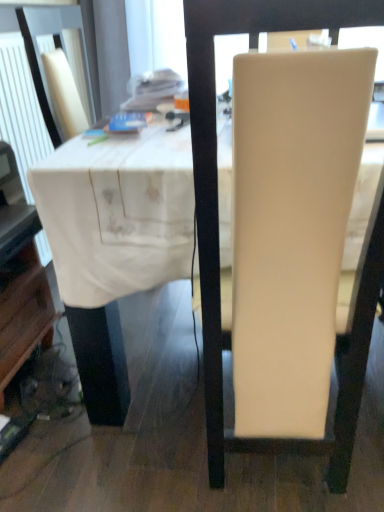
Locate an element on the screen. This screenshot has width=384, height=512. beige leather chair at center is located at coordinates (217, 223).

Image resolution: width=384 pixels, height=512 pixels. What do you see at coordinates (217, 223) in the screenshot?
I see `beige leather chair at center` at bounding box center [217, 223].

You are a GUI agent. You are given a task and a screenshot of the screen. Output one action in this format:
    pyautogui.click(x=<x>, y=<y>)
    Task: Click on the white fabric table at center
    
    Given the screenshot: What is the action you would take?
    pyautogui.click(x=115, y=216)

Describe the element at coordinates (115, 216) in the screenshot. The height and width of the screenshot is (512, 384). I see `white fabric table at center` at that location.

Find the location of a particular element. This screenshot has width=384, height=512. beige leather chair at center is located at coordinates (217, 223).

Would you say beige leather chair at center is to the left or to the right of white fabric table at center in the picture?

beige leather chair at center is to the left of white fabric table at center.

Is beige leather chair at center closer to camera compared to white fabric table at center?

Yes, the depth of beige leather chair at center is less than that of white fabric table at center.

Which is in front, point (336, 485) or point (130, 151)?

The point (130, 151) is closer to the camera.

From the image's perspective, is beige leather chair at center located above white fabric table at center?

No, from the image's perspective, beige leather chair at center is not on top of white fabric table at center.

From a real-world perspective, is beige leather chair at center positioned above or below white fabric table at center?

In terms of real-world spatial position, beige leather chair at center is above white fabric table at center.

In terms of width, does beige leather chair at center look wider or thinner when compared to white fabric table at center?

Clearly, beige leather chair at center has less width compared to white fabric table at center.

From their relative heights in the image, would you say beige leather chair at center is taller or shorter than white fabric table at center?

Considering their sizes, beige leather chair at center has more height than white fabric table at center.

Considering the relative sizes of beige leather chair at center and white fabric table at center in the image provided, is beige leather chair at center bigger than white fabric table at center?

No.

Is beige leather chair at center spatially inside white fabric table at center, or outside of it?

beige leather chair at center fits inside white fabric table at center.

Is beige leather chair at center with white fabric table at center?

They are not placed beside each other.

Could you tell me if beige leather chair at center is turned towards white fabric table at center?

Yes, beige leather chair at center is turned towards white fabric table at center.

Can you tell me how much beige leather chair at center and white fabric table at center differ in facing direction?

They differ by 0.467 degrees in their facing directions.

How distant is beige leather chair at center from white fabric table at center?

10.77 inches.

Where is `chair in front of the white fabric table at center`? The width and height of the screenshot is (384, 512). chair in front of the white fabric table at center is located at coordinates (217, 223).

Is white fabric table at center to the left of beige leather chair at center from the viewer's perspective?

No, white fabric table at center is not to the left of beige leather chair at center.

Does white fabric table at center lie in front of beige leather chair at center?

No, white fabric table at center is further to the viewer.

Is point (219, 154) positioned in front of point (375, 269)?

No, (219, 154) is further to viewer.

From the image's perspective, is white fabric table at center on beige leather chair at center?

Indeed, from the image's perspective, white fabric table at center is shown above beige leather chair at center.

From a real-world perspective, does white fabric table at center sit lower than beige leather chair at center?

Yes.

Is white fabric table at center thinner than beige leather chair at center?

In fact, white fabric table at center might be wider than beige leather chair at center.

Does white fabric table at center have a lesser height compared to beige leather chair at center?

Indeed, white fabric table at center has a lesser height compared to beige leather chair at center.

Considering the sizes of objects white fabric table at center and beige leather chair at center in the image provided, who is smaller, white fabric table at center or beige leather chair at center?

Smaller between the two is beige leather chair at center.

Is white fabric table at center positioned beyond the bounds of beige leather chair at center?

white fabric table at center lies outside beige leather chair at center's area.

Based on the photo, is white fabric table at center positioned far away from beige leather chair at center?

No, white fabric table at center is in close proximity to beige leather chair at center.

Could you tell me if white fabric table at center is turned towards beige leather chair at center?

Yes, white fabric table at center is oriented towards beige leather chair at center.

Where is `chair in front of the white fabric table at center`? The image size is (384, 512). chair in front of the white fabric table at center is located at coordinates (217, 223).

Find the location of a particular element. This screenshot has width=384, height=512. chair on the left of white fabric table at center is located at coordinates (217, 223).

At what (x,y) coordinates should I click in order to perform the action: click on chair below the white fabric table at center (from the image's perspective). Please return your answer as a coordinate pair (x, y). Looking at the image, I should click on (217, 223).